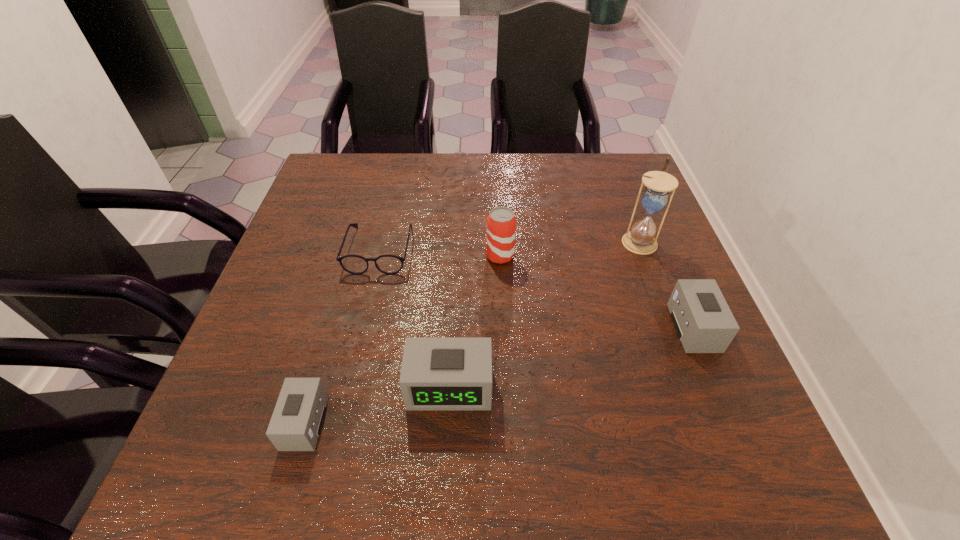
To achieve uniform spacing by inserting another alarm_clock among them, please point to a free space for this new alarm_clock. Please provide its 2D coordinates. Your answer should be formatted as a tuple, i.e. [(x, y)], where the tuple contains the x and y coordinates of a point satisfying the conditions above.

[(578, 356)]